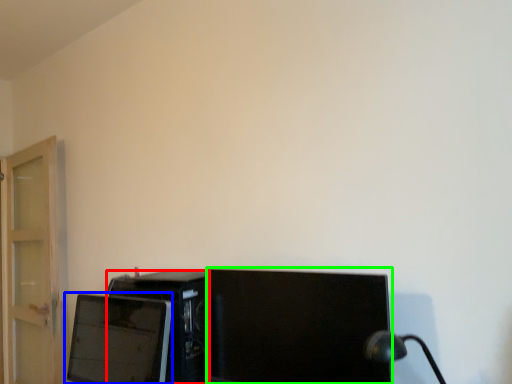
Question: Which is nearer to the desktop computer (highlighted by a red box)? computer monitor (highlighted by a blue box) or computer monitor (highlighted by a green box).

Choices:
 (A) computer monitor
 (B) computer monitor

Answer: (A)